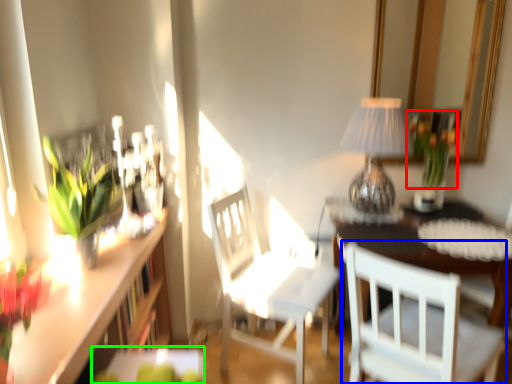
Question: Which is farther away from floral arrangement (highlighted by a red box)? chair (highlighted by a blue box) or table (highlighted by a green box)?

Choices:
 (A) chair
 (B) table

Answer: (B)